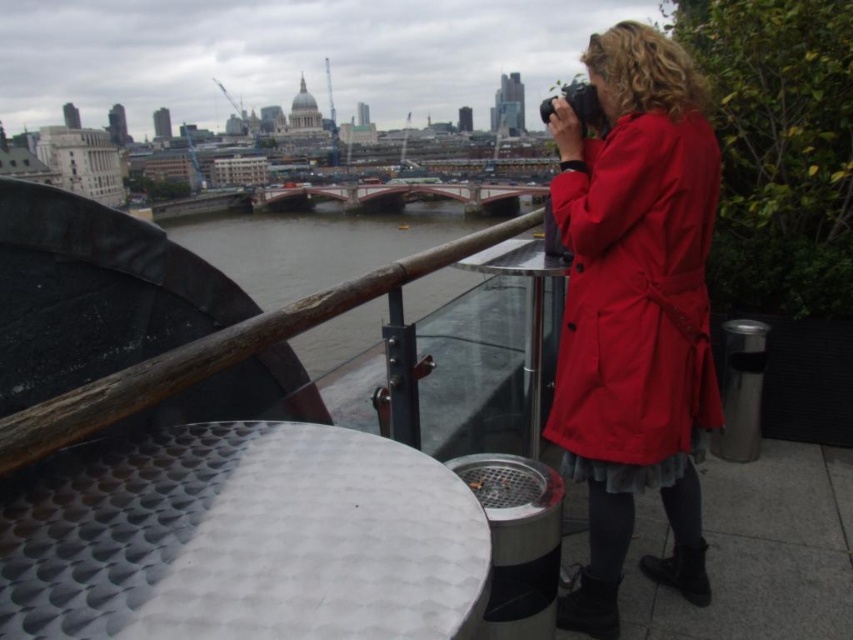
Question: Which of the following is the farthest from the observer?

Choices:
 (A) brown wooden railing at upper center
 (B) brown wooden rail at upper left

Answer: (A)

Question: Can you confirm if matte red coat at right is positioned above brown wooden railing at upper center?

Choices:
 (A) yes
 (B) no

Answer: (B)

Question: Does matte red coat at right lie in front of brown wooden railing at upper center?

Choices:
 (A) yes
 (B) no

Answer: (B)

Question: Which point appears closest to the camera in this image?

Choices:
 (A) (178, 380)
 (B) (630, 262)

Answer: (A)

Question: Which point appears farthest from the camera in this image?

Choices:
 (A) (241, 324)
 (B) (659, 321)

Answer: (B)

Question: In this image, where is matte red coat at right located relative to brown wooden railing at upper center?

Choices:
 (A) right
 (B) left

Answer: (A)